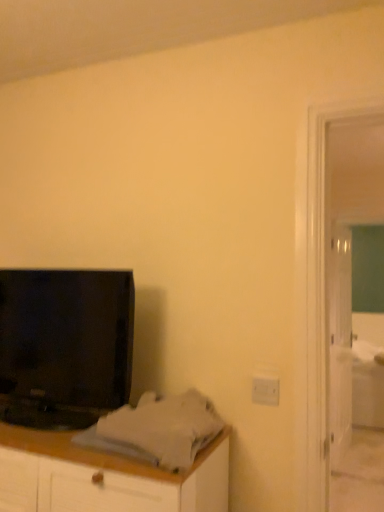
Question: Is white glossy door at right at the right side of black glossy television at left?

Choices:
 (A) yes
 (B) no

Answer: (A)

Question: Is white glossy door at right in front of black glossy television at left?

Choices:
 (A) yes
 (B) no

Answer: (B)

Question: Can you confirm if white glossy door at right is positioned to the left of black glossy television at left?

Choices:
 (A) no
 (B) yes

Answer: (A)

Question: From a real-world perspective, is white glossy door at right physically below black glossy television at left?

Choices:
 (A) no
 (B) yes

Answer: (B)

Question: Is black glossy television at left completely or partially inside white glossy door at right?

Choices:
 (A) no
 (B) yes

Answer: (A)

Question: Can you confirm if white glossy door at right is bigger than black glossy television at left?

Choices:
 (A) no
 (B) yes

Answer: (B)

Question: Is white fabric bed at right oriented away from green glass screen door at right?

Choices:
 (A) no
 (B) yes

Answer: (A)

Question: Considering the relative sizes of white fabric bed at right and green glass screen door at right in the image provided, is white fabric bed at right taller than green glass screen door at right?

Choices:
 (A) no
 (B) yes

Answer: (A)

Question: Does white fabric bed at right have a smaller size compared to green glass screen door at right?

Choices:
 (A) no
 (B) yes

Answer: (A)

Question: Is white fabric bed at right thinner than green glass screen door at right?

Choices:
 (A) yes
 (B) no

Answer: (B)

Question: Is the depth of white fabric bed at right less than that of green glass screen door at right?

Choices:
 (A) yes
 (B) no

Answer: (B)

Question: Considering the relative sizes of white fabric bed at right and green glass screen door at right in the image provided, is white fabric bed at right shorter than green glass screen door at right?

Choices:
 (A) yes
 (B) no

Answer: (A)

Question: Considering the relative sizes of white glossy door at right and green glass screen door at right in the image provided, is white glossy door at right bigger than green glass screen door at right?

Choices:
 (A) no
 (B) yes

Answer: (B)